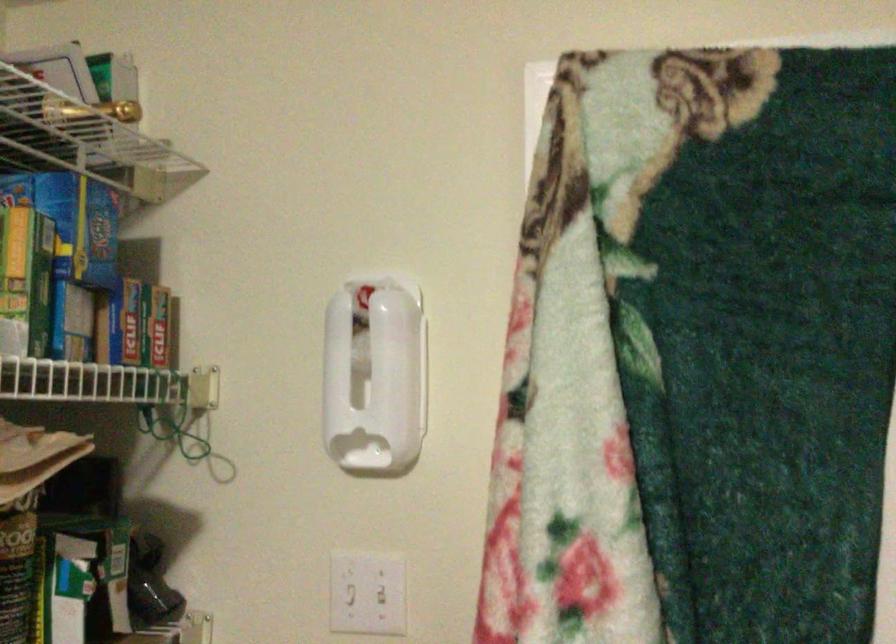
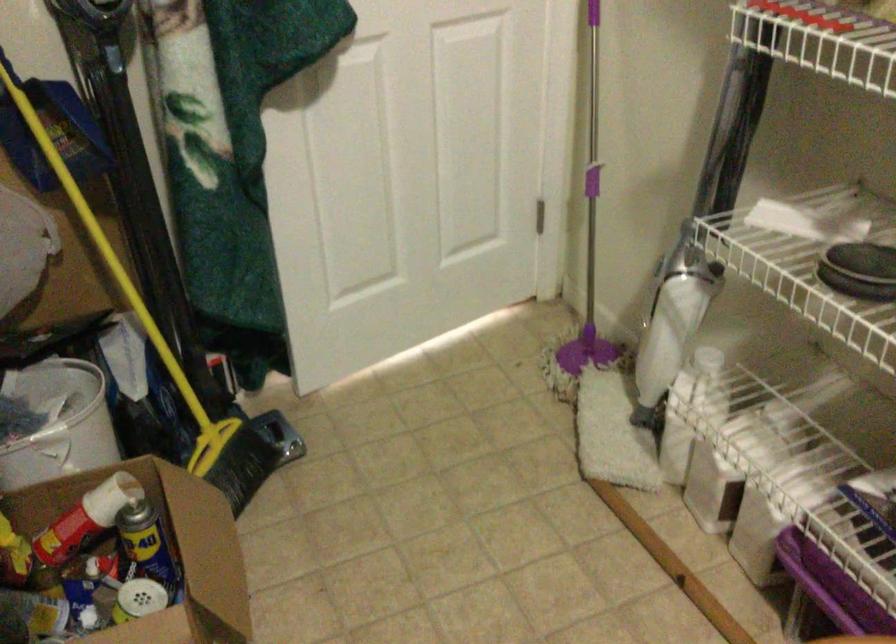
The images are taken continuously from a first-person perspective. In which direction is your viewpoint rotating?

The camera's rotation is toward right-down.